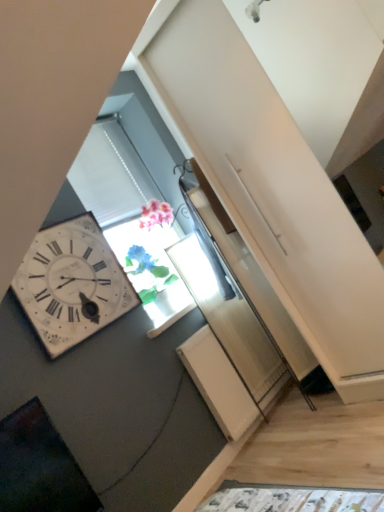
Question: Is white wooden wall clock at left far away from translucent glass vase at center?

Choices:
 (A) yes
 (B) no

Answer: (B)

Question: Could you tell me if white wooden wall clock at left is facing translucent glass vase at center?

Choices:
 (A) yes
 (B) no

Answer: (B)

Question: Can you confirm if white wooden wall clock at left is smaller than translucent glass vase at center?

Choices:
 (A) yes
 (B) no

Answer: (A)

Question: Considering the relative sizes of white wooden wall clock at left and translucent glass vase at center in the image provided, is white wooden wall clock at left taller than translucent glass vase at center?

Choices:
 (A) yes
 (B) no

Answer: (A)

Question: Is translucent glass vase at center at the back of white wooden wall clock at left?

Choices:
 (A) yes
 (B) no

Answer: (B)

Question: From a real-world perspective, is white wooden wall clock at left under translucent glass vase at center?

Choices:
 (A) yes
 (B) no

Answer: (B)

Question: Is translucent glass vase at center thinner than white wooden wall clock at left?

Choices:
 (A) yes
 (B) no

Answer: (B)

Question: Is translucent glass vase at center far from white wooden wall clock at left?

Choices:
 (A) no
 (B) yes

Answer: (A)

Question: Would you say white wooden wall clock at left is part of translucent glass vase at center's contents?

Choices:
 (A) yes
 (B) no

Answer: (B)

Question: Is translucent glass vase at center positioned before white wooden wall clock at left?

Choices:
 (A) yes
 (B) no

Answer: (B)

Question: Does translucent glass vase at center have a larger size compared to white wooden wall clock at left?

Choices:
 (A) yes
 (B) no

Answer: (A)

Question: Is white wooden wall clock at left at the back of translucent glass vase at center?

Choices:
 (A) no
 (B) yes

Answer: (A)

Question: Is point (46, 287) positioned closer to the camera than point (152, 318)?

Choices:
 (A) closer
 (B) farther

Answer: (A)